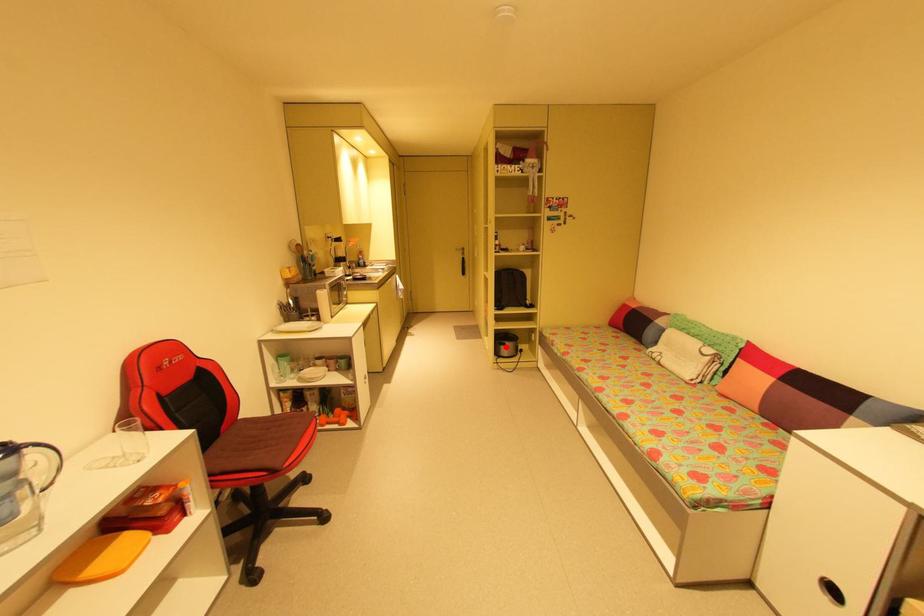
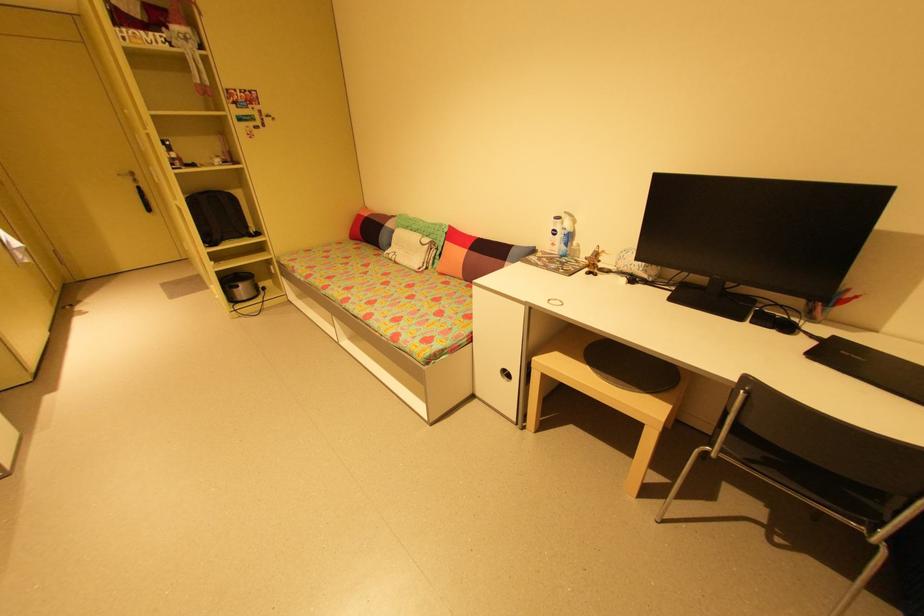
Question: I am providing you with two images of the same scene from different viewpoints. Given a red point in image1, look at the same physical point in image2. Is it:

Choices:
 (A) Closer to the viewpoint
 (B) Farther from the viewpoint

Answer: (A)